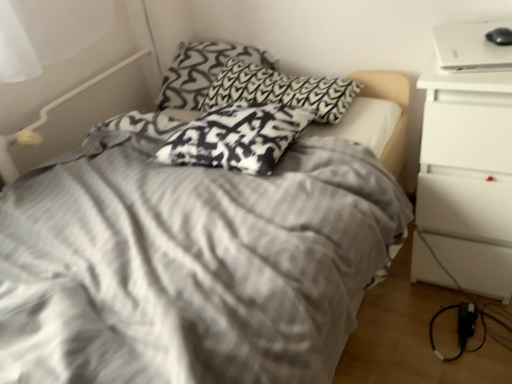
The height and width of the screenshot is (384, 512). What do you see at coordinates (281, 90) in the screenshot?
I see `black and white patterned pillow at center, the second pillow positioned from the back` at bounding box center [281, 90].

Find the location of a particular element. white glossy laptop at upper right is located at coordinates (470, 45).

You are a GUI agent. You are given a task and a screenshot of the screen. Output one action in this format:
    pyautogui.click(x=<x>, y=<y>)
    Task: Click on the black and white patterned pillow at upper center, arranged as the 1th pillow when viewed from the back
    
    Given the screenshot: What is the action you would take?
    pyautogui.click(x=203, y=71)

What is the approximate width of white plastic bed frame at upper left?

The width of white plastic bed frame at upper left is 8.53 inches.

This screenshot has width=512, height=384. What do you see at coordinates (189, 263) in the screenshot?
I see `gray striped bed at center` at bounding box center [189, 263].

What is the approximate width of white matte nightstand at right?

white matte nightstand at right is 20.67 inches in width.

Measure the distance between white matte nightstand at right and camera.

white matte nightstand at right and camera are 3.33 feet apart.

Where is `black and white patterned pillow at center, the second pillow positioned from the back`? This screenshot has width=512, height=384. black and white patterned pillow at center, the second pillow positioned from the back is located at coordinates (281, 90).

Considering the relative positions of white glossy laptop at upper right and white plastic bed frame at upper left in the image provided, is white glossy laptop at upper right to the left or to the right of white plastic bed frame at upper left?

From the image, it's evident that white glossy laptop at upper right is to the right of white plastic bed frame at upper left.

Based on the photo, could you tell me if white glossy laptop at upper right is facing white plastic bed frame at upper left?

No, white glossy laptop at upper right is not turned towards white plastic bed frame at upper left.

Does point (446, 48) come farther from viewer compared to point (7, 154)?

No, (446, 48) is closer to viewer.

Between white glossy laptop at upper right and white plastic bed frame at upper left, which one is positioned behind?

white plastic bed frame at upper left.

Which of these two, gray striped bed at center or black plastic power adapter at lower right, is smaller?

Smaller between the two is black plastic power adapter at lower right.

From a real-world perspective, is gray striped bed at center on top of black plastic power adapter at lower right?

Yes, from a real-world perspective, gray striped bed at center is above black plastic power adapter at lower right.

Looking at this image, is gray striped bed at center wider than black plastic power adapter at lower right?

Correct, the width of gray striped bed at center exceeds that of black plastic power adapter at lower right.

Would you say black and white patterned pillow at upper center, the third pillow from the front, is inside or outside black and white patterned pillow at center, acting as the 3th pillow starting from the back?

black and white patterned pillow at upper center, the third pillow from the front, cannot be found inside black and white patterned pillow at center, acting as the 3th pillow starting from the back.

From the image's perspective, relative to black and white patterned pillow at center, acting as the 3th pillow starting from the back, is black and white patterned pillow at upper center, arranged as the 1th pillow when viewed from the back, above or below?

Based on their image positions, black and white patterned pillow at upper center, arranged as the 1th pillow when viewed from the back, is located above black and white patterned pillow at center, acting as the 3th pillow starting from the back.

Is black and white patterned pillow at upper center, arranged as the 1th pillow when viewed from the back, not near black and white patterned pillow at center, the first pillow when ordered from front to back?

They are positioned close to each other.

Measure the distance from white matte nightstand at right to black and white patterned pillow at center, the first pillow when ordered from front to back.

They are 20.27 inches apart.

In the scene shown: Does white matte nightstand at right turn towards black and white patterned pillow at center, acting as the 3th pillow starting from the back?

No, white matte nightstand at right is not turned towards black and white patterned pillow at center, acting as the 3th pillow starting from the back.

Considering the positions of objects white matte nightstand at right and black and white patterned pillow at center, acting as the 3th pillow starting from the back, in the image provided, who is more to the left, white matte nightstand at right or black and white patterned pillow at center, acting as the 3th pillow starting from the back,?

Positioned to the left is black and white patterned pillow at center, acting as the 3th pillow starting from the back.

Considering their positions, is white matte nightstand at right located in front of or behind black and white patterned pillow at center, the first pillow when ordered from front to back?

white matte nightstand at right is in front of black and white patterned pillow at center, the first pillow when ordered from front to back.

In the image, is black plastic power adapter at lower right positioned in front of or behind black and white patterned pillow at upper center, the third pillow from the front?

Clearly, black plastic power adapter at lower right is in front of black and white patterned pillow at upper center, the third pillow from the front.

Is black plastic power adapter at lower right facing away from black and white patterned pillow at upper center, arranged as the 1th pillow when viewed from the back?

black plastic power adapter at lower right is not turned away from black and white patterned pillow at upper center, arranged as the 1th pillow when viewed from the back.

Considering the sizes of objects black plastic power adapter at lower right and black and white patterned pillow at upper center, arranged as the 1th pillow when viewed from the back, in the image provided, who is bigger, black plastic power adapter at lower right or black and white patterned pillow at upper center, arranged as the 1th pillow when viewed from the back,?

With larger size is black and white patterned pillow at upper center, arranged as the 1th pillow when viewed from the back.

Does black plastic power adapter at lower right have a greater height compared to black and white patterned pillow at upper center, the third pillow from the front?

No.

Which is behind, point (269, 159) or point (30, 125)?

The point (30, 125) is behind.

From the image's perspective, which object appears higher, black and white patterned pillow at center, acting as the 3th pillow starting from the back, or white plastic bed frame at upper left?

white plastic bed frame at upper left appears higher in the image.

Is black and white patterned pillow at center, the first pillow when ordered from front to back, wider than white plastic bed frame at upper left?

Yes, black and white patterned pillow at center, the first pillow when ordered from front to back, is wider than white plastic bed frame at upper left.

Is black and white patterned pillow at center, the first pillow when ordered from front to back, oriented towards white plastic bed frame at upper left?

No, black and white patterned pillow at center, the first pillow when ordered from front to back, does not turn towards white plastic bed frame at upper left.

Consider the image. Looking at their sizes, would you say black plastic power adapter at lower right is wider or thinner than white plastic bed frame at upper left?

In the image, black plastic power adapter at lower right appears to be more narrow than white plastic bed frame at upper left.

Is black plastic power adapter at lower right far from white plastic bed frame at upper left?

Yes, black plastic power adapter at lower right is far from white plastic bed frame at upper left.

Which is more to the right, black plastic power adapter at lower right or white plastic bed frame at upper left?

From the viewer's perspective, black plastic power adapter at lower right appears more on the right side.

At what (x,y) coordinates should I click in order to perform the action: click on laptop above the white plastic bed frame at upper left (from a real-world perspective). Please return your answer as a coordinate pair (x, y). Looking at the image, I should click on (470, 45).

Where is `electric outlet below the gray striped bed at center (from the image's perspective)`? electric outlet below the gray striped bed at center (from the image's perspective) is located at coordinates (466, 322).

Which object lies further to the anchor point black and white patterned pillow at center, the first pillow when ordered from front to back, black and white patterned pillow at center, positioned as the 2th pillow in front-to-back order, or gray striped bed at center?

gray striped bed at center lies further to black and white patterned pillow at center, the first pillow when ordered from front to back, than the other object.

Which object lies nearer to the anchor point white plastic bed frame at upper left, white glossy laptop at upper right or black and white patterned pillow at upper center, arranged as the 1th pillow when viewed from the back?

black and white patterned pillow at upper center, arranged as the 1th pillow when viewed from the back.

Estimate the real-world distances between objects in this image. Which object is closer to black and white patterned pillow at upper center, the third pillow from the front, black plastic power adapter at lower right or white plastic bed frame at upper left?

The object closer to black and white patterned pillow at upper center, the third pillow from the front, is white plastic bed frame at upper left.

From the picture: Looking at the image, which one is located further to gray striped bed at center, white plastic bed frame at upper left or black and white patterned pillow at center, the second pillow positioned from the back?

white plastic bed frame at upper left is further to gray striped bed at center.

Looking at this image, looking at the image, which one is located closer to gray striped bed at center, white plastic bed frame at upper left or black plastic power adapter at lower right?

white plastic bed frame at upper left lies closer to gray striped bed at center than the other object.

Estimate the real-world distances between objects in this image. Which object is further from black and white patterned pillow at upper center, the third pillow from the front, white glossy laptop at upper right or black and white patterned pillow at center, acting as the 3th pillow starting from the back?

Based on the image, white glossy laptop at upper right appears to be further to black and white patterned pillow at upper center, the third pillow from the front.

Considering their positions, is black plastic power adapter at lower right positioned further to black and white patterned pillow at upper center, the third pillow from the front, than black and white patterned pillow at center, the first pillow when ordered from front to back?

The object further to black and white patterned pillow at upper center, the third pillow from the front, is black plastic power adapter at lower right.

Considering their positions, is black and white patterned pillow at center, acting as the 3th pillow starting from the back, positioned further to black plastic power adapter at lower right than black and white patterned pillow at center, positioned as the 2th pillow in front-to-back order?

black and white patterned pillow at center, positioned as the 2th pillow in front-to-back order, lies further to black plastic power adapter at lower right than the other object.

Where is `bed between white plastic bed frame at upper left and white glossy laptop at upper right`? Image resolution: width=512 pixels, height=384 pixels. bed between white plastic bed frame at upper left and white glossy laptop at upper right is located at coordinates (189, 263).

Find the location of a particular element. laptop located between white plastic bed frame at upper left and white matte nightstand at right in the left-right direction is located at coordinates (470, 45).

What are the coordinates of `bed frame between gray striped bed at center and black and white patterned pillow at upper center, the third pillow from the front, in the front-back direction` in the screenshot? It's located at (82, 89).

Identify the location of electric outlet situated between black and white patterned pillow at upper center, arranged as the 1th pillow when viewed from the back, and white matte nightstand at right from left to right. (466, 322).